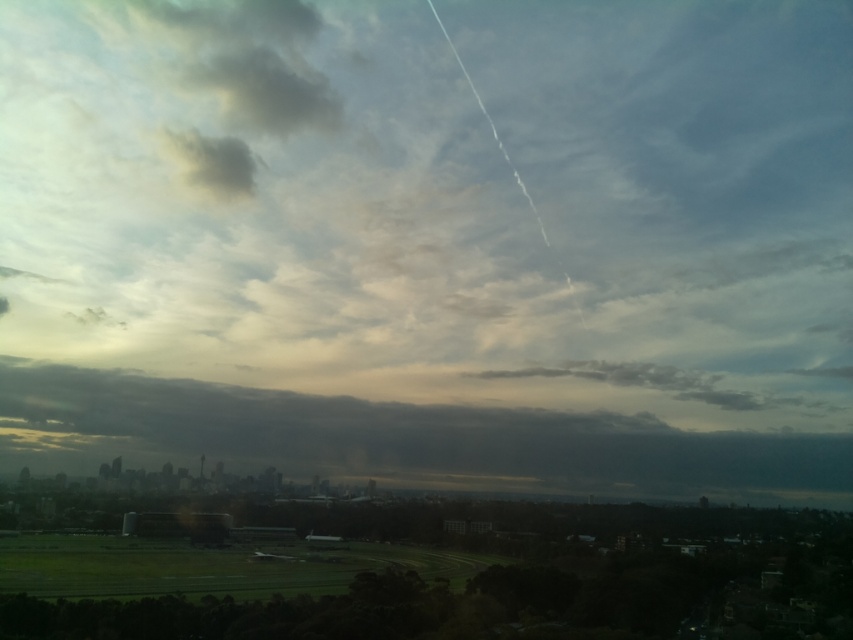
You are an airplane pilot preparing to navigate through the clouds. You see two dark gray clouds in the sky. Which cloud would require more caution due to its size? Please refer to the dark gray cloud at center and the dark gray cloud at upper left in your answer.

The dark gray cloud at center has a larger size compared to the dark gray cloud at upper left, so the dark gray cloud at center would require more caution due to its size.

You are an airplane pilot preparing for takeoff at an airport located near the city shown in the image. You notice two dark gray clouds in the sky. The first is the dark gray cloud at center, and the second is the dark gray cloud at upper left. Based on their sizes, which cloud might pose a greater risk for turbulence during takeoff?

The dark gray cloud at center is taller than the dark gray cloud at upper left, so it might pose a greater risk for turbulence during takeoff because taller clouds often indicate stronger atmospheric disturbances.

You are an airplane pilot preparing to land at the airport located in the city shown in the image. You need to avoid flying through any clouds to ensure visibility. Which dark gray cloud should you avoid flying under first, the dark gray cloud at center or the dark gray cloud at upper left?

You should avoid flying under the dark gray cloud at upper left first because the dark gray cloud at center is positioned under it, meaning the upper left cloud is higher in the sky.